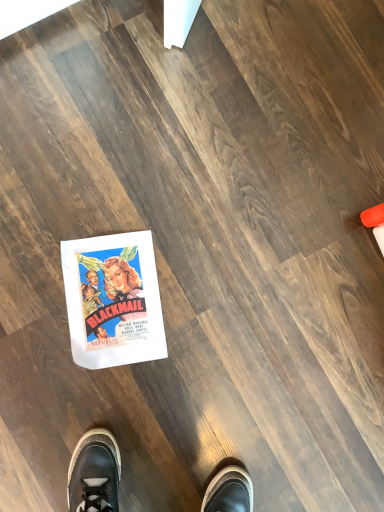
Find the location of a particular element. Image resolution: width=384 pixels, height=512 pixels. vacant space in front of white paper at center is located at coordinates (51, 370).